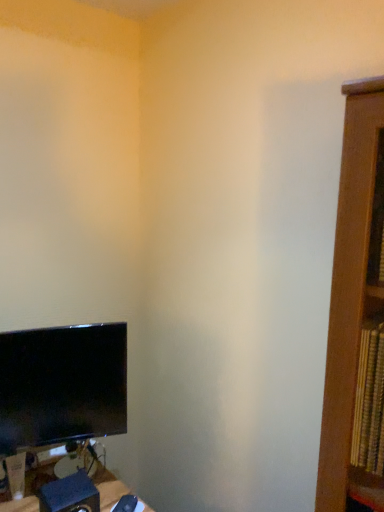
Question: Is blue matte speaker at lower left looking in the opposite direction of black glossy monitor at lower left?

Choices:
 (A) no
 (B) yes

Answer: (A)

Question: Is the depth of blue matte speaker at lower left less than that of black glossy monitor at lower left?

Choices:
 (A) yes
 (B) no

Answer: (A)

Question: Does blue matte speaker at lower left have a lesser height compared to black glossy monitor at lower left?

Choices:
 (A) yes
 (B) no

Answer: (A)

Question: Is blue matte speaker at lower left smaller than black glossy monitor at lower left?

Choices:
 (A) yes
 (B) no

Answer: (A)

Question: From the image's perspective, is blue matte speaker at lower left located beneath black glossy monitor at lower left?

Choices:
 (A) no
 (B) yes

Answer: (B)

Question: Is blue matte speaker at lower left to the right of black glossy monitor at lower left from the viewer's perspective?

Choices:
 (A) yes
 (B) no

Answer: (A)

Question: Can you confirm if black glossy monitor at lower left is taller than blue matte speaker at lower left?

Choices:
 (A) no
 (B) yes

Answer: (B)

Question: Is black glossy monitor at lower left facing towards blue matte speaker at lower left?

Choices:
 (A) yes
 (B) no

Answer: (B)

Question: Can you confirm if black glossy monitor at lower left is positioned to the left of blue matte speaker at lower left?

Choices:
 (A) yes
 (B) no

Answer: (A)

Question: Is black glossy monitor at lower left placed right next to blue matte speaker at lower left?

Choices:
 (A) no
 (B) yes

Answer: (A)

Question: From a real-world perspective, is black glossy monitor at lower left positioned under blue matte speaker at lower left based on gravity?

Choices:
 (A) yes
 (B) no

Answer: (B)

Question: Can you confirm if black glossy monitor at lower left is thinner than blue matte speaker at lower left?

Choices:
 (A) no
 (B) yes

Answer: (B)

Question: Considering their positions, is blue matte speaker at lower left located in front of or behind black glossy monitor at lower left?

Choices:
 (A) behind
 (B) front

Answer: (B)